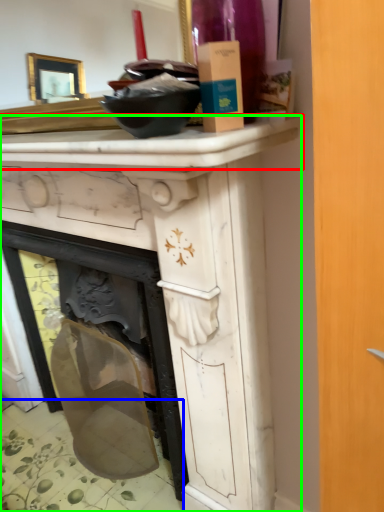
Question: Considering the real-world distances, which object is farthest from counter top (highlighted by a red box)? tile (highlighted by a blue box) or vanity (highlighted by a green box)?

Choices:
 (A) tile
 (B) vanity

Answer: (A)